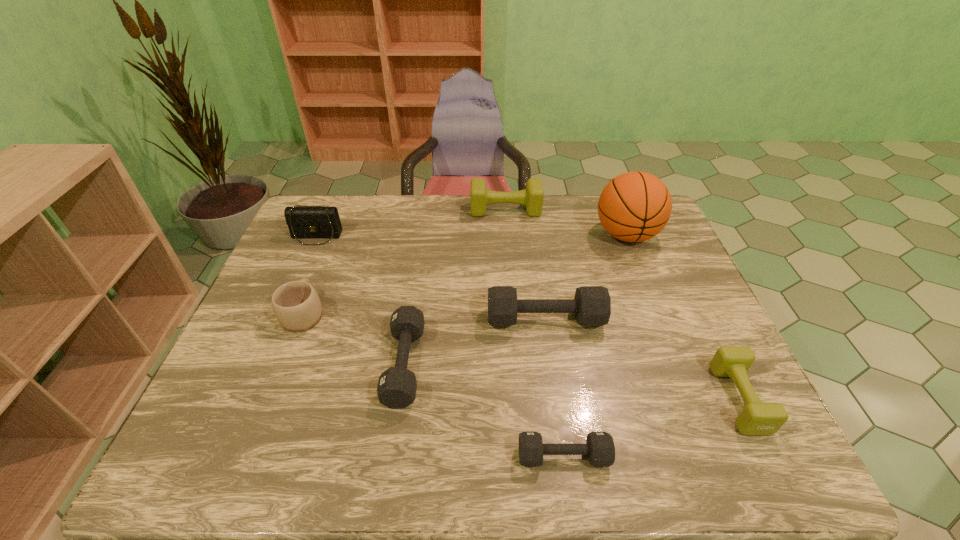
Locate an element on the screen. Image resolution: width=960 pixels, height=540 pixels. vacant region located on the left of the leftmost dumbbell is located at coordinates click(354, 364).

You are a GUI agent. You are given a task and a screenshot of the screen. Output one action in this format:
    pyautogui.click(x=<x>, y=<y>)
    Task: Click on the free space located on the back of the nearer olive dumbbell
    
    Given the screenshot: What is the action you would take?
    pyautogui.click(x=709, y=339)

In order to click on vacant space located 0.330m on the back of the nearest object in this screenshot , I will do `click(544, 321)`.

You are a GUI agent. You are given a task and a screenshot of the screen. Output one action in this format:
    pyautogui.click(x=<x>, y=<y>)
    Task: Click on the basketball positioned at the far edge
    
    Given the screenshot: What is the action you would take?
    pyautogui.click(x=635, y=206)

This screenshot has height=540, width=960. What are the coordinates of `dumbbell situated at the far edge` in the screenshot? It's located at (532, 197).

I want to click on clutch bag that is at the far edge, so click(312, 222).

Where is `clutch bag at the left edge`? clutch bag at the left edge is located at coordinates (312, 222).

This screenshot has width=960, height=540. I want to click on mug that is positioned at the left edge, so click(296, 305).

Where is `basketball that is at the right edge`? This screenshot has width=960, height=540. basketball that is at the right edge is located at coordinates (635, 206).

Find the location of a particular element. The height and width of the screenshot is (540, 960). dumbbell situated at the right edge is located at coordinates (757, 418).